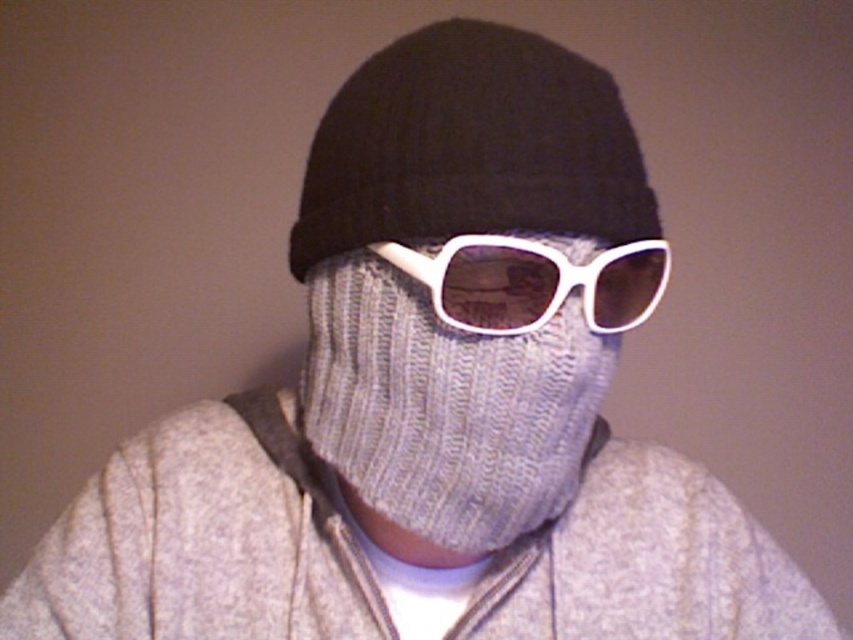
Question: Which of the following is the farthest from the observer?

Choices:
 (A) black knitted hat at center
 (B) knitted gray mask at center
 (C) white plastic goggles at center

Answer: (B)

Question: Does knitted gray mask at center appear over black knitted hat at center?

Choices:
 (A) no
 (B) yes

Answer: (A)

Question: Which point is farther from the camera taking this photo?

Choices:
 (A) (428, 488)
 (B) (555, 307)

Answer: (A)

Question: Does black knitted hat at center have a greater width compared to white plastic goggles at center?

Choices:
 (A) no
 (B) yes

Answer: (B)

Question: Which of the following is the farthest from the observer?

Choices:
 (A) black knitted hat at center
 (B) knitted gray mask at center

Answer: (B)

Question: Is knitted gray mask at center to the left of white plastic goggles at center from the viewer's perspective?

Choices:
 (A) yes
 (B) no

Answer: (A)